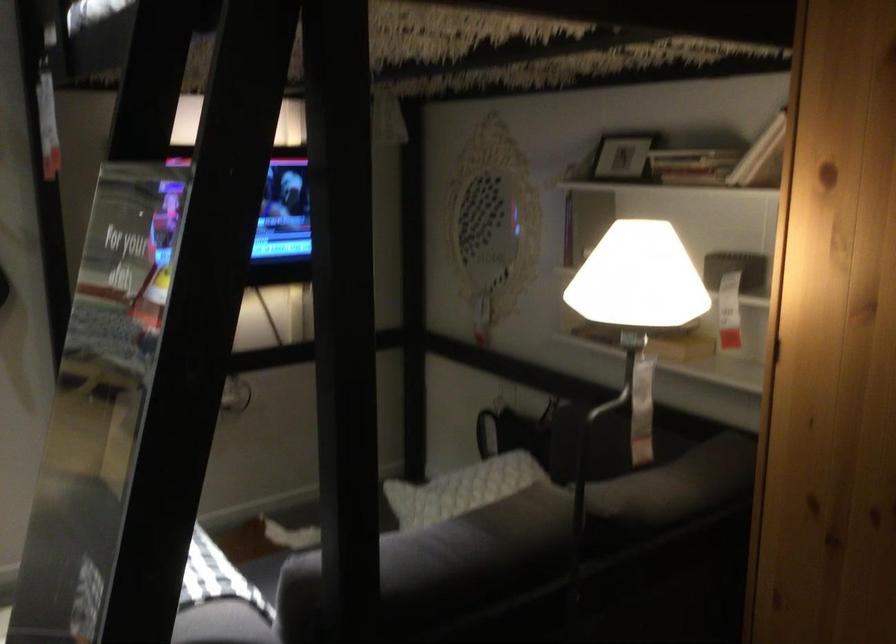
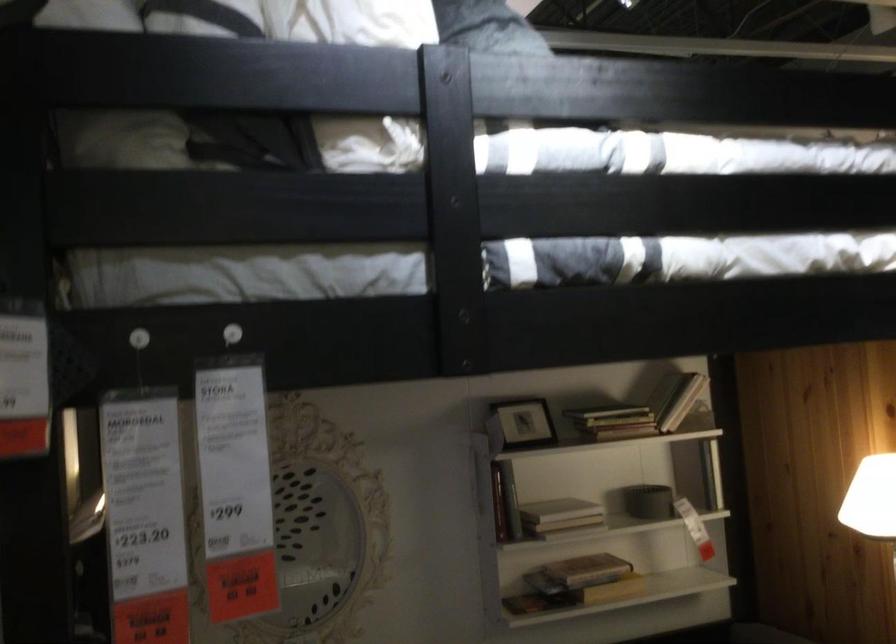
Where in the second image is the point corresponding to (x=698, y=266) from the first image?

(648, 502)